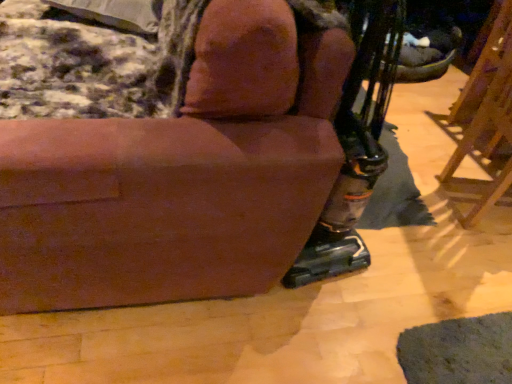
Question: Considering the relative positions of brown wood easel at right and velvety gray pillow at upper left in the image provided, is brown wood easel at right to the right of velvety gray pillow at upper left from the viewer's perspective?

Choices:
 (A) no
 (B) yes

Answer: (B)

Question: From a real-world perspective, is brown wood easel at right located higher than velvety gray pillow at upper left?

Choices:
 (A) yes
 (B) no

Answer: (B)

Question: Is the surface of brown wood easel at right in direct contact with velvety gray pillow at upper left?

Choices:
 (A) yes
 (B) no

Answer: (B)

Question: Does brown wood easel at right lie behind velvety gray pillow at upper left?

Choices:
 (A) yes
 (B) no

Answer: (B)

Question: Is brown wood easel at right wider than velvety gray pillow at upper left?

Choices:
 (A) yes
 (B) no

Answer: (B)

Question: From the image's perspective, does brown wood easel at right appear higher than velvety gray pillow at upper left?

Choices:
 (A) no
 (B) yes

Answer: (A)

Question: Is brown fabric chair at center bigger than velvety gray pillow at upper left?

Choices:
 (A) no
 (B) yes

Answer: (B)

Question: Does brown fabric chair at center have a greater width compared to velvety gray pillow at upper left?

Choices:
 (A) no
 (B) yes

Answer: (B)

Question: From the image's perspective, is brown fabric chair at center above velvety gray pillow at upper left?

Choices:
 (A) yes
 (B) no

Answer: (B)

Question: Can you confirm if brown fabric chair at center is smaller than velvety gray pillow at upper left?

Choices:
 (A) no
 (B) yes

Answer: (A)

Question: Does brown fabric chair at center have a lesser width compared to velvety gray pillow at upper left?

Choices:
 (A) yes
 (B) no

Answer: (B)

Question: Is brown fabric chair at center aimed at velvety gray pillow at upper left?

Choices:
 (A) no
 (B) yes

Answer: (B)

Question: Considering the relative sizes of brown fabric chair at center and brown wood easel at right in the image provided, is brown fabric chair at center taller than brown wood easel at right?

Choices:
 (A) no
 (B) yes

Answer: (B)